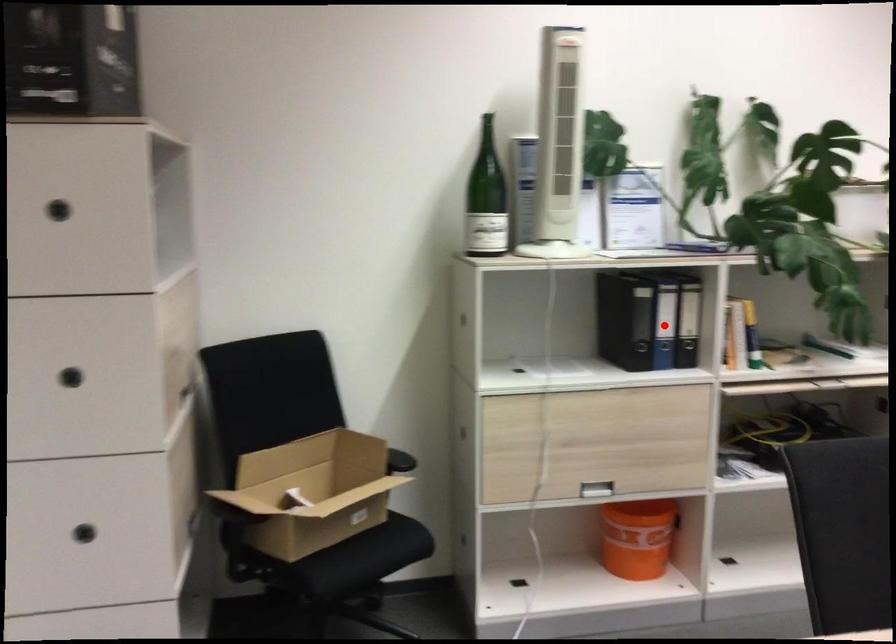
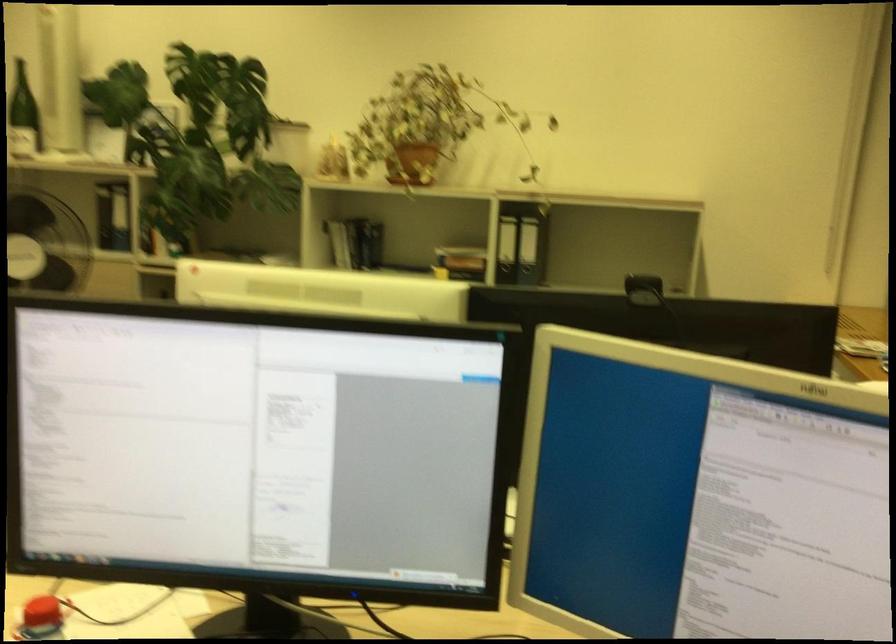
Question: I am providing you with two images of the same scene from different viewpoints. A red point is marked on the first image. Can you still see the location of the red point in image 2?

Choices:
 (A) Yes
 (B) No

Answer: (B)